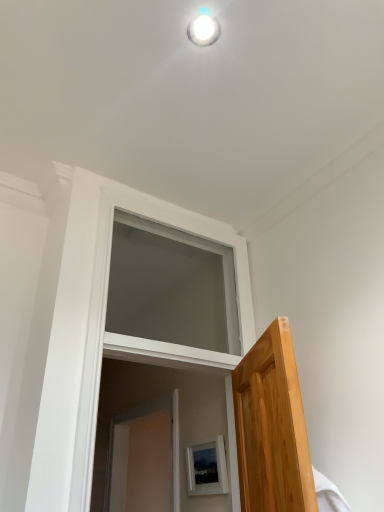
Question: Is matte white picture frame at lower center positioned far away from white matte window at center?

Choices:
 (A) no
 (B) yes

Answer: (A)

Question: Are matte white picture frame at lower center and white matte window at center making contact?

Choices:
 (A) yes
 (B) no

Answer: (B)

Question: Is matte white picture frame at lower center completely or partially outside of white matte window at center?

Choices:
 (A) no
 (B) yes

Answer: (B)

Question: Can you confirm if matte white picture frame at lower center is wider than white matte window at center?

Choices:
 (A) no
 (B) yes

Answer: (A)

Question: From the image's perspective, is matte white picture frame at lower center under white matte window at center?

Choices:
 (A) yes
 (B) no

Answer: (A)

Question: From the image's perspective, is matte white picture frame at lower center positioned above or below white matte window at center?

Choices:
 (A) above
 (B) below

Answer: (B)

Question: In the image, is matte white picture frame at lower center positioned in front of or behind white matte window at center?

Choices:
 (A) front
 (B) behind

Answer: (B)

Question: Is matte white picture frame at lower center to the left or to the right of white matte window at center in the image?

Choices:
 (A) left
 (B) right

Answer: (B)

Question: In terms of height, does matte white picture frame at lower center look taller or shorter compared to white matte window at center?

Choices:
 (A) tall
 (B) short

Answer: (B)

Question: Looking at their shapes, would you say matte white picture frame at lower center is wider or thinner than white glossy light fixture at upper center?

Choices:
 (A) wide
 (B) thin

Answer: (B)

Question: Considering the positions of matte white picture frame at lower center and white glossy light fixture at upper center in the image, is matte white picture frame at lower center taller or shorter than white glossy light fixture at upper center?

Choices:
 (A) short
 (B) tall

Answer: (B)

Question: Does point (185, 464) appear closer or farther from the camera than point (203, 26)?

Choices:
 (A) farther
 (B) closer

Answer: (A)

Question: Based on their sizes in the image, would you say matte white picture frame at lower center is bigger or smaller than white glossy light fixture at upper center?

Choices:
 (A) small
 (B) big

Answer: (B)

Question: From their relative heights in the image, would you say white glossy light fixture at upper center is taller or shorter than white matte window at center?

Choices:
 (A) tall
 (B) short

Answer: (B)

Question: From the image's perspective, is white glossy light fixture at upper center positioned above or below white matte window at center?

Choices:
 (A) below
 (B) above

Answer: (B)